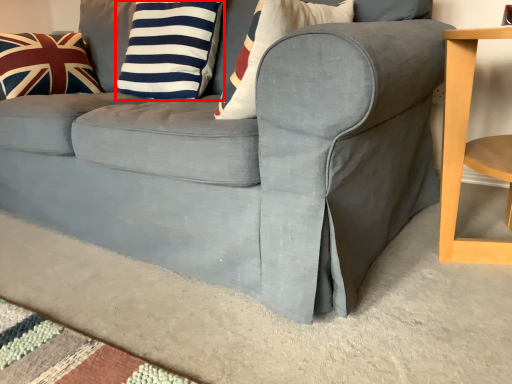
Question: From the image's perspective, what is the correct spatial relationship of pillow (annotated by the red box) in relation to pillow?

Choices:
 (A) above
 (B) below

Answer: (B)